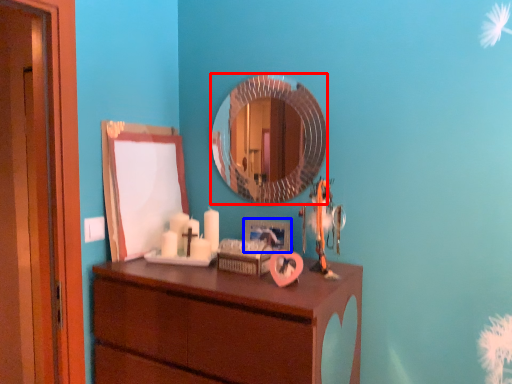
Question: Which object is further to the camera taking this photo, mirror (highlighted by a red box) or picture frame (highlighted by a blue box)?

Choices:
 (A) mirror
 (B) picture frame

Answer: (B)